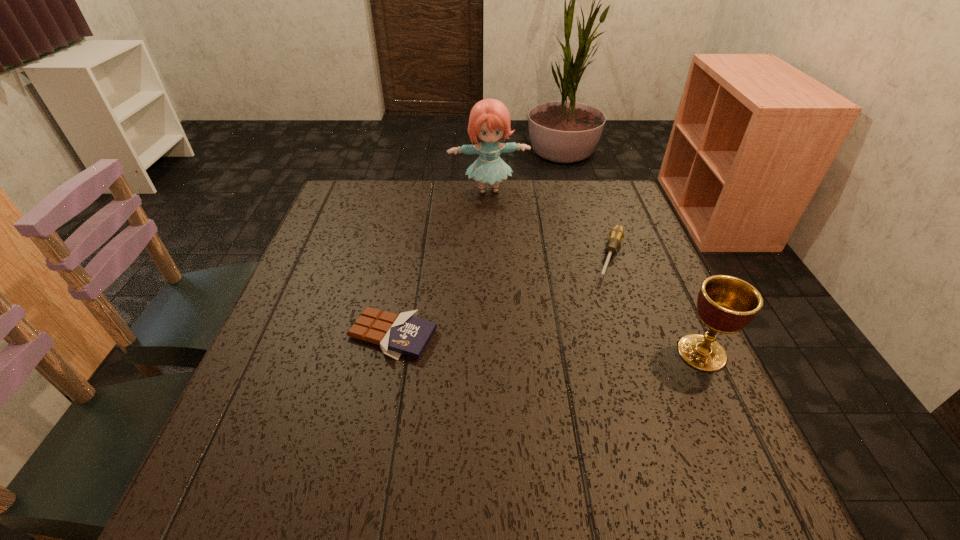
The image size is (960, 540). Identify the location of free space that satisfies the following two spatial constraints: 1. on the front side of the shortest object; 2. on the left side of the chalice. (389, 353).

At what (x,y) coordinates should I click in order to perform the action: click on vacant space that satisfies the following two spatial constraints: 1. on the front side of the doll; 2. on the left side of the second farthest object. Please return your answer as a coordinate pair (x, y). This screenshot has height=540, width=960. Looking at the image, I should click on (491, 257).